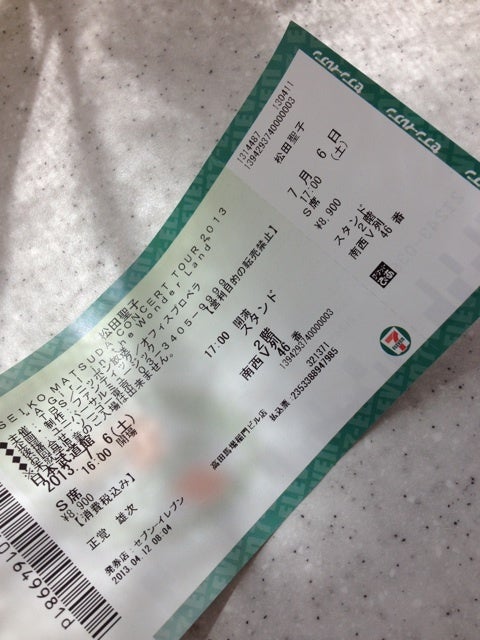
Where is `countertop`? This screenshot has height=640, width=480. countertop is located at coordinates (346, 548).